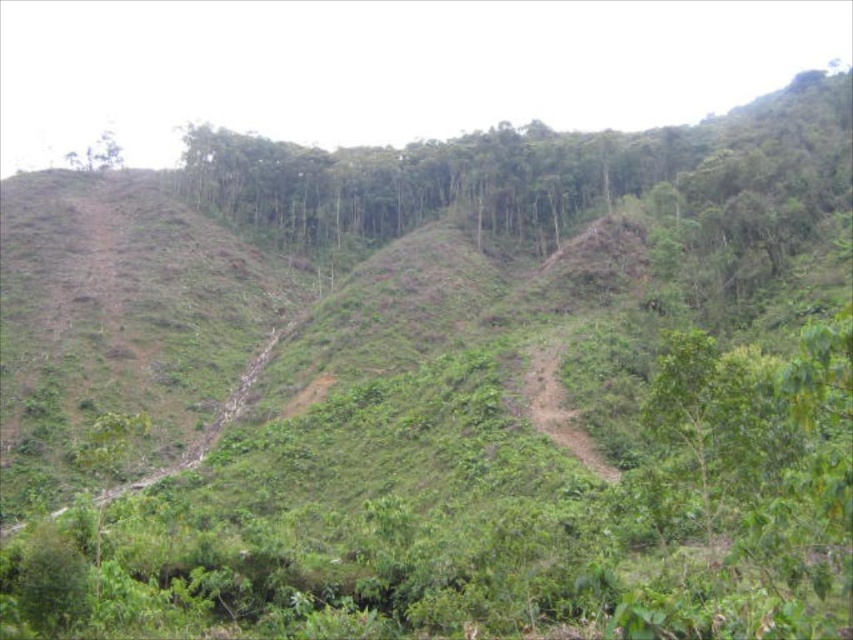
Between point (576, 449) and point (94, 163), which one is positioned behind?

Positioned behind is point (94, 163).

Measure the distance between point (538, 394) and camera.

Point (538, 394) and camera are 50.63 meters apart from each other.

Is point (566, 326) closer to viewer compared to point (119, 148)?

That is True.

This screenshot has height=640, width=853. Identify the location of brown dirt track at center. (556, 403).